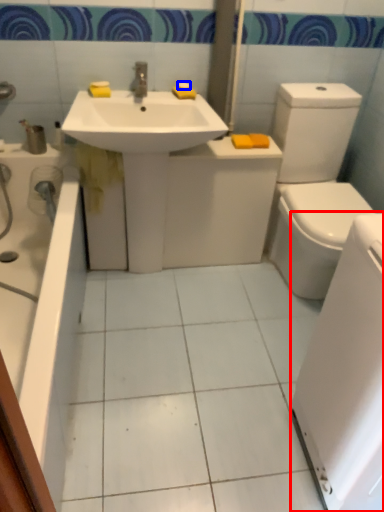
Question: Which object is closer to the camera taking this photo, appliance (highlighted by a red box) or soap (highlighted by a blue box)?

Choices:
 (A) appliance
 (B) soap

Answer: (A)